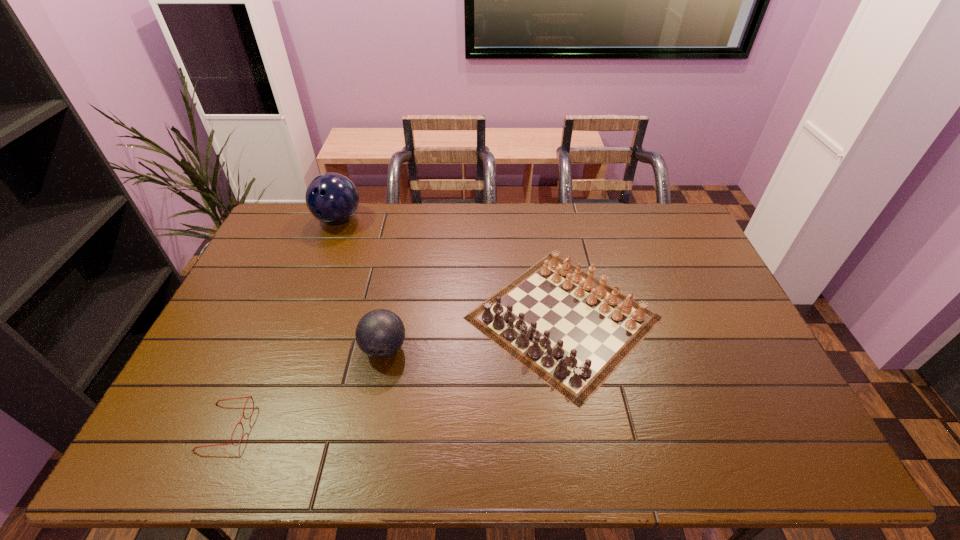
Image resolution: width=960 pixels, height=540 pixels. Find the location of `blank region between the rightmost object and the nearer bowling ball`. blank region between the rightmost object and the nearer bowling ball is located at coordinates (473, 333).

Locate an element on the screen. This screenshot has height=540, width=960. the closest object to the rightmost object is located at coordinates (380, 333).

This screenshot has height=540, width=960. I want to click on object that can be found as the second closest to the shortest object, so click(573, 334).

Identify the location of vacant area that satisfies the following two spatial constraints: 1. on the surface of the tallest object near the finger holes; 2. on the face of the shortest object. The image size is (960, 540). (258, 427).

Locate an element on the screen. This screenshot has width=960, height=540. free location that satisfies the following two spatial constraints: 1. on the grip area of the shorter bowling ball; 2. on the face of the shortest object is located at coordinates (369, 427).